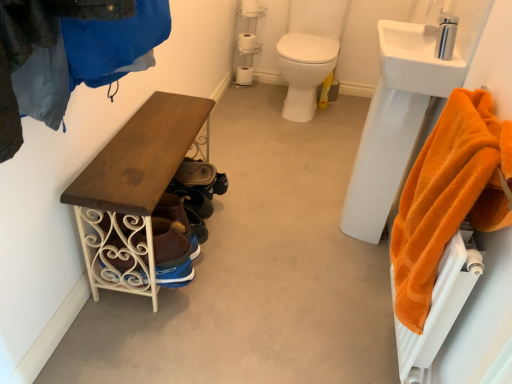
Locate an element on the screen. blank area to the left of white glossy toilet at center is located at coordinates (244, 100).